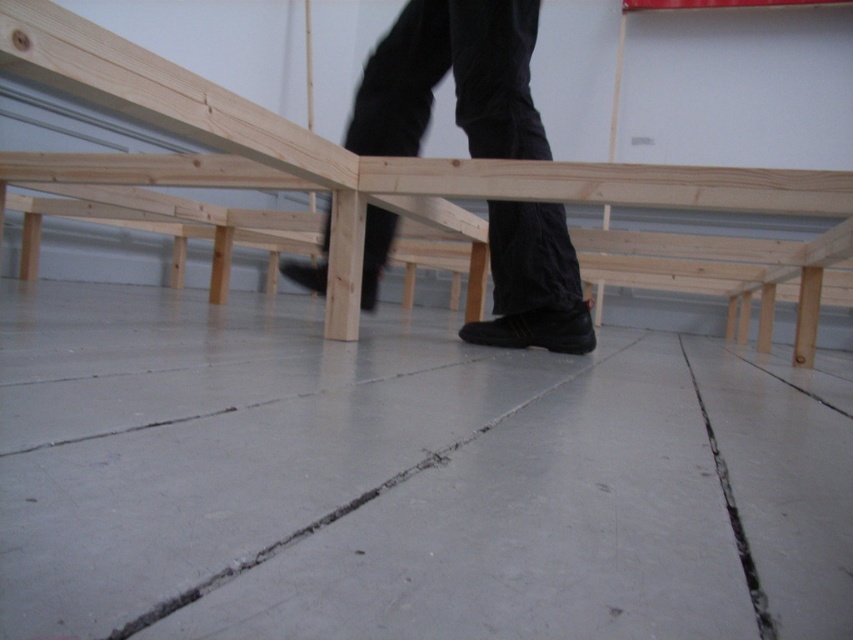
Question: Which point appears closest to the camera in this image?

Choices:
 (A) (527, 19)
 (B) (109, 61)

Answer: (B)

Question: Among these objects, which one is farthest from the camera?

Choices:
 (A) natural wood bunk bed at center
 (B) black matte pants at center

Answer: (B)

Question: Observing the image, what is the correct spatial positioning of natural wood bunk bed at center in reference to black matte pants at center?

Choices:
 (A) right
 (B) left

Answer: (B)

Question: Where is natural wood bunk bed at center located in relation to black matte pants at center in the image?

Choices:
 (A) right
 (B) left

Answer: (B)

Question: Does natural wood bunk bed at center appear over black matte pants at center?

Choices:
 (A) yes
 (B) no

Answer: (B)